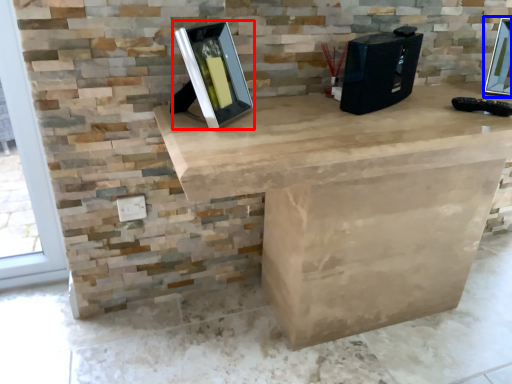
Question: Among these objects, which one is farthest to the camera, picture frame (highlighted by a red box) or picture frame (highlighted by a blue box)?

Choices:
 (A) picture frame
 (B) picture frame

Answer: (B)